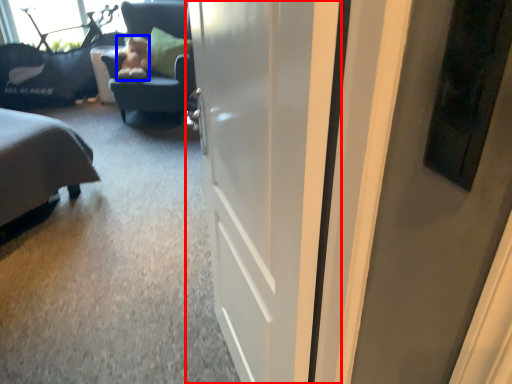
Question: Which object is further to the camera taking this photo, door (highlighted by a red box) or teddy (highlighted by a blue box)?

Choices:
 (A) door
 (B) teddy

Answer: (B)